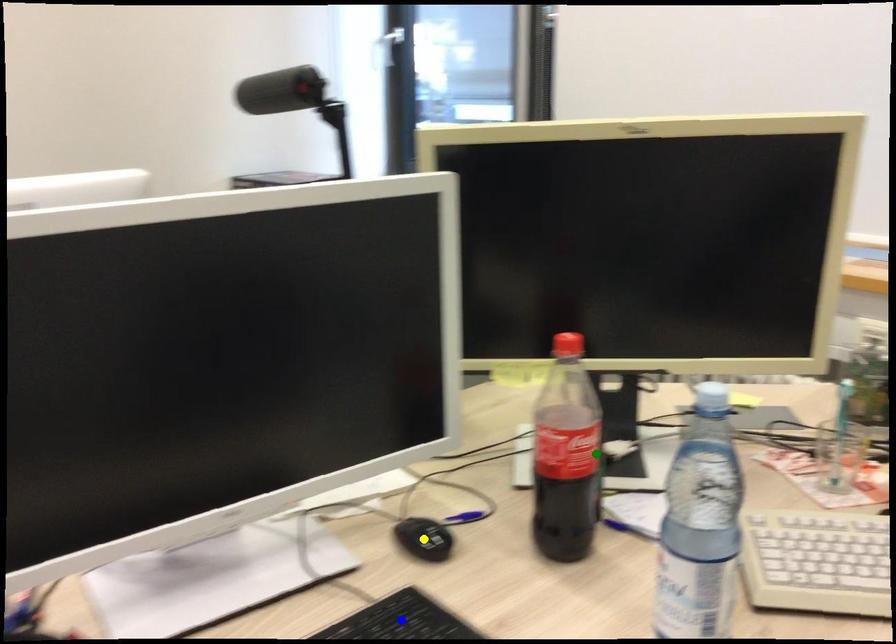
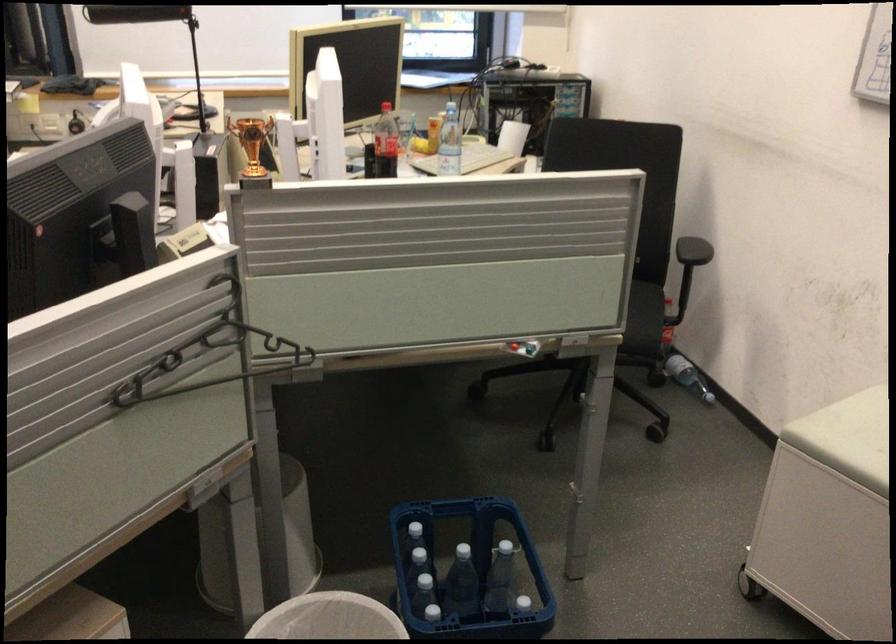
I am providing you with two images of the same scene from different viewpoints. Three points are marked in image1. Which point corresponds to a part or object that is occluded in image2?In image1, three points are marked. Which of them correspond to a part or object that is occluded in image2?Among the three points shown in image1, which one corresponds to a part or object that is no longer visible due to occlusion in image2?

yellow point, blue point cannot be seen in image2.